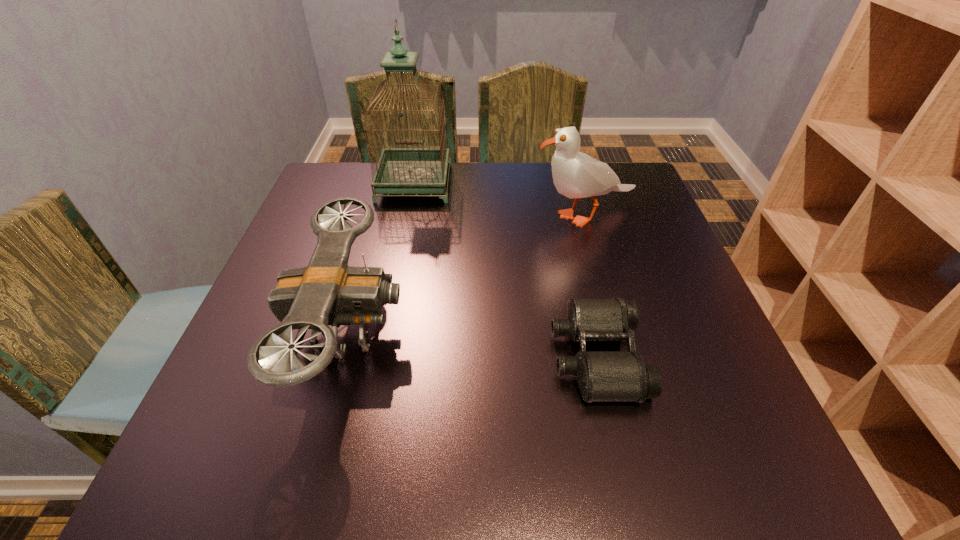
The image size is (960, 540). In order to click on the tallest object in this screenshot , I will do `click(401, 170)`.

I want to click on the third shortest object, so click(575, 174).

This screenshot has width=960, height=540. In order to click on the third tallest object in this screenshot , I will do `click(328, 292)`.

What are the coordinates of `the shortest object` in the screenshot? It's located at (601, 375).

Where is `blank space located at the door of the birdcage`? The image size is (960, 540). blank space located at the door of the birdcage is located at coordinates (393, 291).

Where is `blank space located 0.140m at the beak of the gull`? blank space located 0.140m at the beak of the gull is located at coordinates (475, 216).

Where is `blank space located 0.130m at the beak of the gull`? The image size is (960, 540). blank space located 0.130m at the beak of the gull is located at coordinates (479, 216).

The width and height of the screenshot is (960, 540). I want to click on vacant region located at the beak of the gull, so click(x=427, y=216).

Where is `free space located on the front-facing side of the drone`? Image resolution: width=960 pixels, height=540 pixels. free space located on the front-facing side of the drone is located at coordinates (525, 330).

Image resolution: width=960 pixels, height=540 pixels. What are the coordinates of `vacant space located through the eyepieces of the binoculars` in the screenshot? It's located at (384, 356).